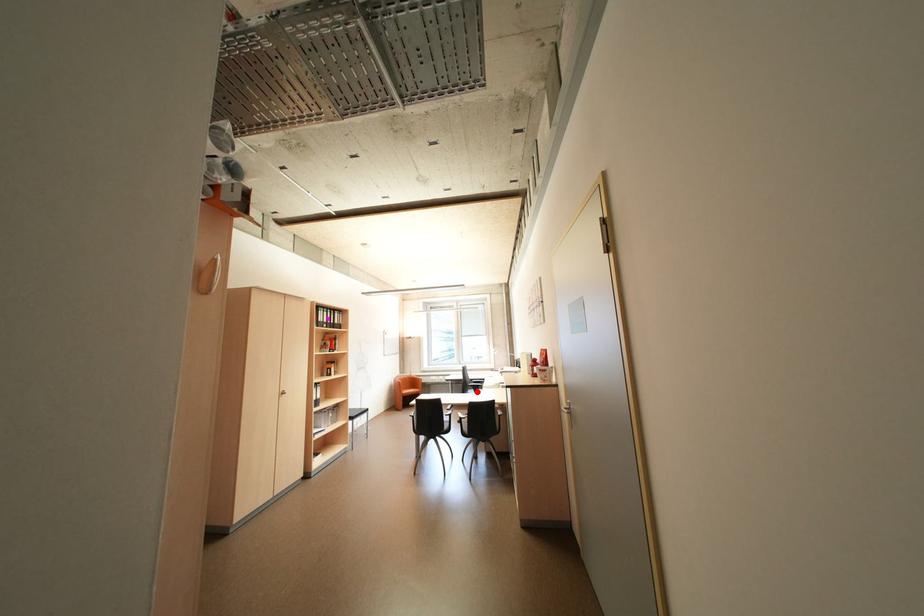
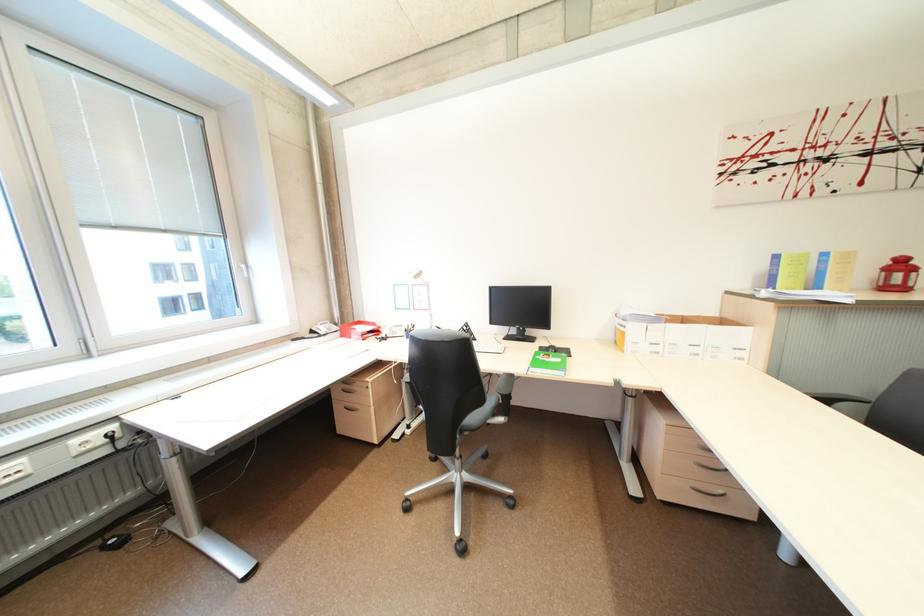
In the second image, find the point that corresponds to the highlighted location in the first image.

(482, 419)